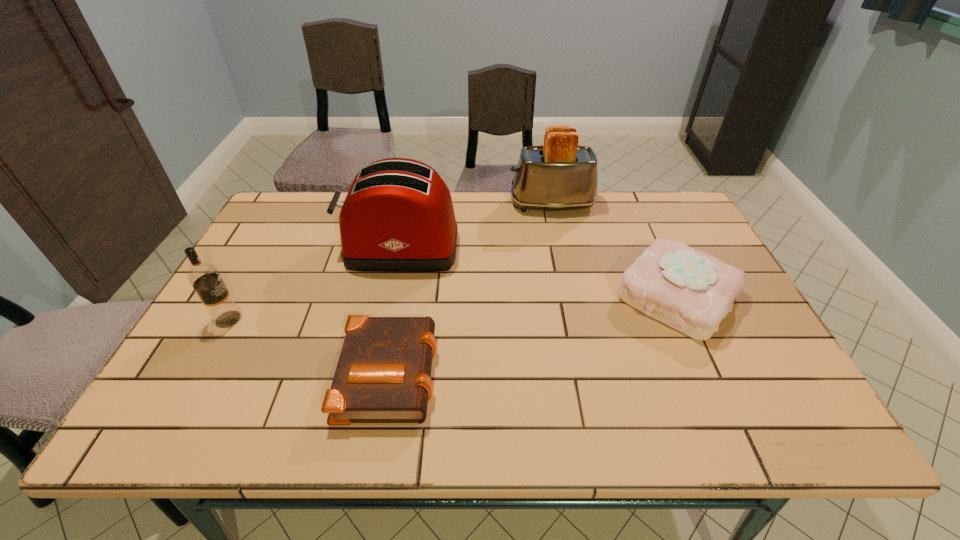
This screenshot has width=960, height=540. I want to click on empty location between the farther toaster and the Bible, so click(x=470, y=288).

Locate an element on the screen. the second closest object to the left toaster is located at coordinates (383, 373).

Identify which object is located as the second nearest to the fourth tallest object. Please provide its 2D coordinates. Your answer should be formatted as a tuple, i.e. [(x, y)], where the tuple contains the x and y coordinates of a point satisfying the conditions above.

[(398, 216)]

Find the location of a particular element. This screenshot has height=540, width=960. free point that satisfies the following two spatial constraints: 1. on the front side of the nearer toaster; 2. on the label of the leftmost object is located at coordinates (385, 319).

At what (x,y) coordinates should I click in order to perform the action: click on vacant area in the image that satisfies the following two spatial constraints: 1. on the front side of the cake; 2. on the left side of the left toaster. Please return your answer as a coordinate pair (x, y). Looking at the image, I should click on (390, 296).

Where is `free region that satisfies the following two spatial constraints: 1. on the front side of the nearer toaster; 2. on the label of the vodka`? The width and height of the screenshot is (960, 540). free region that satisfies the following two spatial constraints: 1. on the front side of the nearer toaster; 2. on the label of the vodka is located at coordinates point(385,319).

I want to click on vacant region that satisfies the following two spatial constraints: 1. on the front side of the cake; 2. on the right side of the left toaster, so click(390, 296).

In order to click on vacant point that satisfies the following two spatial constraints: 1. on the side of the right toaster with the control lever; 2. on the left side of the cake in this screenshot , I will do `click(571, 296)`.

What are the coordinates of `free region that satisfies the following two spatial constraints: 1. on the front side of the nearer toaster; 2. on the right side of the cake` in the screenshot? It's located at (390, 296).